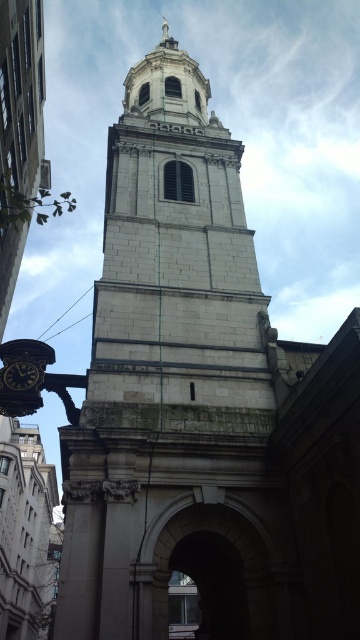
Question: Which of the following is the closest to the observer?

Choices:
 (A) (262, 560)
 (B) (25, 378)

Answer: (A)

Question: Which point is closer to the camera?

Choices:
 (A) black glossy clock at lower left
 (B) stone archway at center

Answer: (B)

Question: Can you confirm if stone archway at center is bigger than black glossy clock at lower left?

Choices:
 (A) yes
 (B) no

Answer: (A)

Question: Which point is closer to the camera?

Choices:
 (A) (6, 376)
 (B) (254, 636)

Answer: (B)

Question: Is stone archway at center to the left of black glossy clock at lower left from the viewer's perspective?

Choices:
 (A) no
 (B) yes

Answer: (A)

Question: Is the position of stone archway at center less distant than that of black glossy clock at lower left?

Choices:
 (A) yes
 (B) no

Answer: (A)